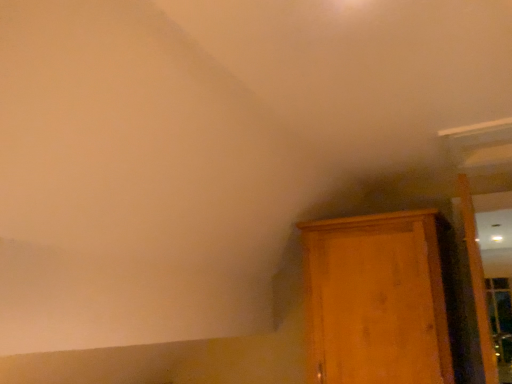
Image resolution: width=512 pixels, height=384 pixels. Identify the location of wooden cabinet at right. (377, 299).

Describe the element at coordinates (377, 299) in the screenshot. This screenshot has height=384, width=512. I see `wooden cabinet at right` at that location.

The image size is (512, 384). Describe the element at coordinates (477, 279) in the screenshot. I see `wooden door at right` at that location.

The height and width of the screenshot is (384, 512). What are the coordinates of `wooden door at right` in the screenshot? It's located at (477, 279).

Find the location of a particular element. wooden cabinet at right is located at coordinates (377, 299).

Is wooden door at right to the left of wooden cabinet at right from the viewer's perspective?

No, wooden door at right is not to the left of wooden cabinet at right.

Is wooden door at right in front of or behind wooden cabinet at right in the image?

Clearly, wooden door at right is in front of wooden cabinet at right.

Between point (476, 267) and point (356, 218), which one is positioned behind?

The point (476, 267) is behind.

From the image's perspective, is wooden door at right located above wooden cabinet at right?

Yes.

From a real-world perspective, between wooden door at right and wooden cabinet at right, who is vertically higher?

wooden door at right.

Is wooden door at right wider than wooden cabinet at right?

No.

Does wooden door at right have a greater height compared to wooden cabinet at right?

Yes, wooden door at right is taller than wooden cabinet at right.

Considering the relative sizes of wooden door at right and wooden cabinet at right in the image provided, is wooden door at right smaller than wooden cabinet at right?

Correct, wooden door at right occupies less space than wooden cabinet at right.

Is wooden cabinet at right surrounded by wooden door at right?

No, wooden cabinet at right is not inside wooden door at right.

Are wooden door at right and wooden cabinet at right located far from each other?

wooden door at right is near wooden cabinet at right, not far away.

Is wooden door at right facing towards wooden cabinet at right?

Yes, wooden door at right is turned towards wooden cabinet at right.

How much distance is there between wooden door at right and wooden cabinet at right?

wooden door at right and wooden cabinet at right are 28.06 inches apart from each other.

At what (x,y) coordinates should I click in order to perform the action: click on door on the right of wooden cabinet at right. Please return your answer as a coordinate pair (x, y). The image size is (512, 384). Looking at the image, I should click on pyautogui.click(x=477, y=279).

Which is more to the right, wooden cabinet at right or wooden door at right?

wooden door at right is more to the right.

Is wooden cabinet at right further to the viewer compared to wooden door at right?

Yes, wooden cabinet at right is behind wooden door at right.

Which is in front, point (328, 317) or point (466, 224)?

The point (328, 317) is closer to the camera.

From the image's perspective, is wooden cabinet at right located above or below wooden door at right?

wooden cabinet at right is below wooden door at right.

From a real-world perspective, relative to wooden door at right, is wooden cabinet at right vertically above or below?

From a real-world perspective, wooden cabinet at right is physically below wooden door at right.

Considering the relative sizes of wooden cabinet at right and wooden door at right in the image provided, is wooden cabinet at right wider than wooden door at right?

Indeed, wooden cabinet at right has a greater width compared to wooden door at right.

Is wooden cabinet at right taller than wooden door at right?

In fact, wooden cabinet at right may be shorter than wooden door at right.

Who is smaller, wooden cabinet at right or wooden door at right?

wooden door at right.

Is wooden door at right surrounded by wooden cabinet at right?

No, wooden door at right is located outside of wooden cabinet at right.

Is wooden cabinet at right not near wooden door at right?

No, wooden cabinet at right is in close proximity to wooden door at right.

Is wooden cabinet at right aimed at wooden door at right?

No, wooden cabinet at right is not aimed at wooden door at right.

Measure the distance between wooden cabinet at right and wooden door at right.

They are 28.06 inches apart.

Identify the location of door on the right side of wooden cabinet at right. (477, 279).

I want to click on door on the right of wooden cabinet at right, so click(477, 279).

Where is `cupboard lying behind the wooden door at right`? cupboard lying behind the wooden door at right is located at coordinates (377, 299).